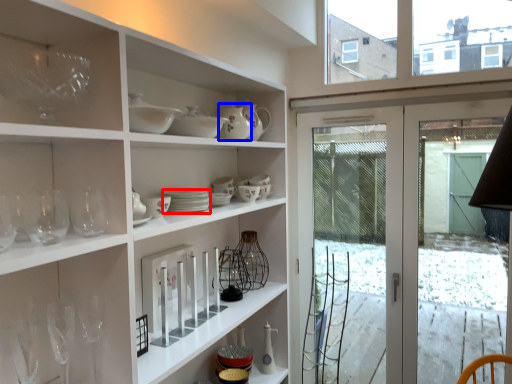
Question: Among these objects, which one is farthest to the camera, tableware (highlighted by a red box) or tableware (highlighted by a blue box)?

Choices:
 (A) tableware
 (B) tableware

Answer: (B)